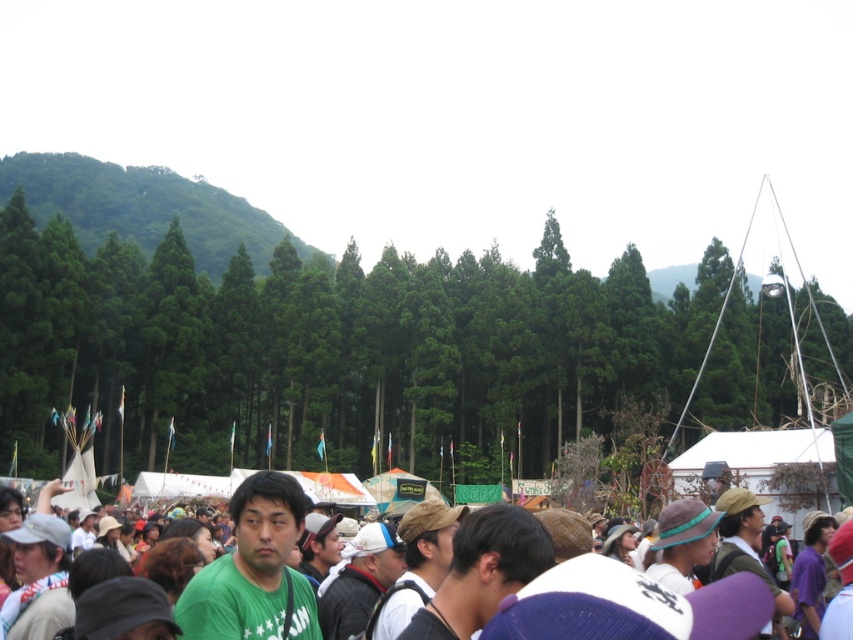
Question: Can you confirm if green matte shirt at center is wider than green fabric shirt at center?

Choices:
 (A) yes
 (B) no

Answer: (A)

Question: Is green fabric crowd at center to the right of green matte shirt at center from the viewer's perspective?

Choices:
 (A) no
 (B) yes

Answer: (B)

Question: Which point appears closest to the camera in this image?

Choices:
 (A) (466, 524)
 (B) (408, 522)

Answer: (A)

Question: Based on their relative distances, which object is farther from the dark green t-shirt at center?

Choices:
 (A) green fabric crowd at center
 (B) white matte cap at center
 (C) green matte shirt at center

Answer: (C)

Question: Among these objects, which one is farthest from the camera?

Choices:
 (A) green matte shirt at center
 (B) white matte cap at center
 (C) green fabric shirt at center
 (D) dark green t-shirt at center

Answer: (B)

Question: In this image, where is green matte shirt at center located relative to green fabric shirt at center?

Choices:
 (A) above
 (B) below

Answer: (A)